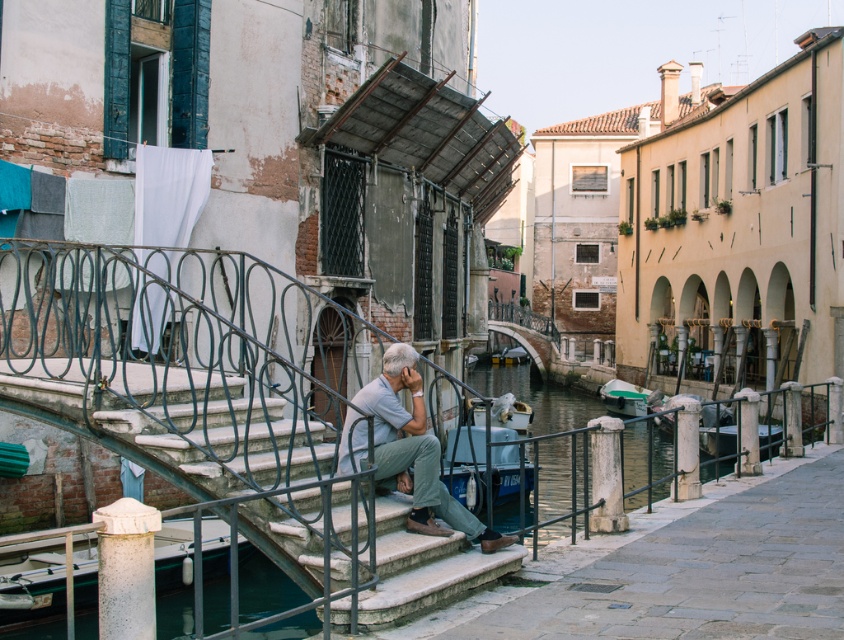
Is smooth concrete stairs at center above light gray fabric pants at center?

No, smooth concrete stairs at center is not above light gray fabric pants at center.

Does smooth concrete stairs at center have a greater height compared to light gray fabric pants at center?

No.

Where is `smooth concrete stairs at center`? smooth concrete stairs at center is located at coordinates (423, 566).

The width and height of the screenshot is (844, 640). What are the coordinates of `metallic gray railing at center` in the screenshot? It's located at (199, 392).

Which is behind, point (271, 400) or point (90, 564)?

The point (90, 564) is more distant.

Where is `metallic gray railing at center`? Image resolution: width=844 pixels, height=640 pixels. metallic gray railing at center is located at coordinates (199, 392).

Can you confirm if smooth concrete stairs at center is positioned to the right of green plastic boat at lower right?

Incorrect, smooth concrete stairs at center is not on the right side of green plastic boat at lower right.

Does smooth concrete stairs at center appear over green plastic boat at lower right?

Correct, smooth concrete stairs at center is located above green plastic boat at lower right.

Find the location of a particular element. The height and width of the screenshot is (640, 844). smooth concrete stairs at center is located at coordinates (423, 566).